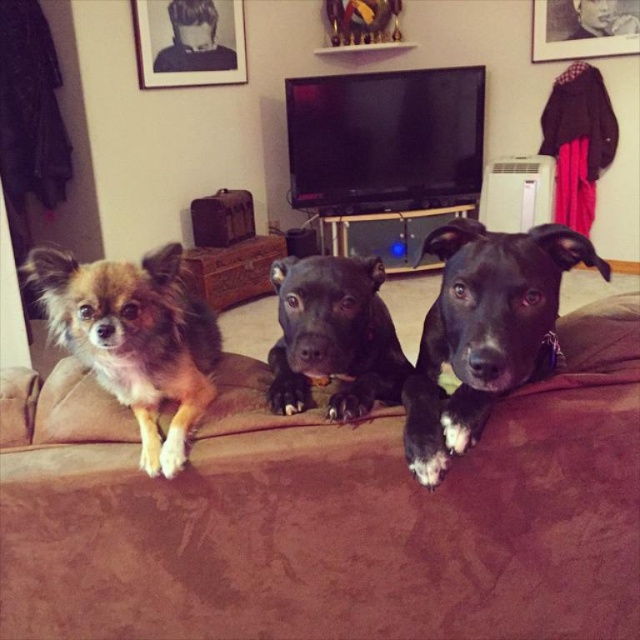
Describe the element at coordinates (333, 515) in the screenshot. The height and width of the screenshot is (640, 640). I see `brown fabric couch at center` at that location.

Looking at this image, is brown fabric couch at center to the right of fuzzy brown dog at left from the viewer's perspective?

Indeed, brown fabric couch at center is positioned on the right side of fuzzy brown dog at left.

Where is `brown fabric couch at center`? brown fabric couch at center is located at coordinates (333, 515).

Measure the distance between black matte dog at center and fuzzy brown dog at left.

black matte dog at center is 48.33 centimeters from fuzzy brown dog at left.

Between point (541, 364) and point (193, 413), which one is positioned behind?

The point (541, 364) is behind.

Which is behind, point (426, 321) or point (115, 378)?

Point (426, 321)

The image size is (640, 640). What are the coordinates of `black matte dog at center` in the screenshot? It's located at (484, 330).

Is brown fabric couch at center positioned in front of black matte dog at center?

No, it is behind black matte dog at center.

Is point (131, 468) positioned behind point (544, 320)?

Yes, point (131, 468) is farther from viewer.

This screenshot has width=640, height=640. Identify the location of brown fabric couch at center. (333, 515).